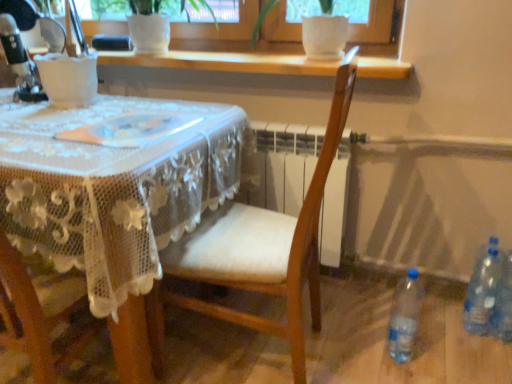
I want to click on vacant space positioned to the left of transparent plastic bottle at lower right, the 3th bottle when ordered from right to left, so click(347, 352).